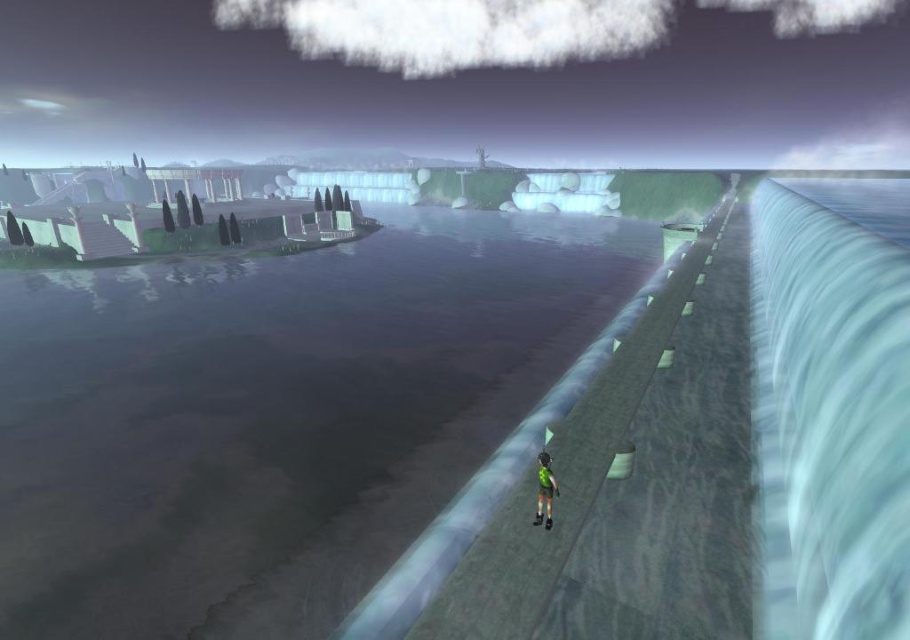
You are a drone operator trying to capture a photo of the dam from above. The drone has a camera that can only focus on objects within a 0.1 unit radius around the point 0.6, 0.3. Will the smooth concrete water at center be in focus?

The smooth concrete water at center is located at point (273, 416), which is within the 0.1 unit radius of the camera focus point (273, 384). Therefore, the smooth concrete water at center will be in focus.

You are a character in the game needing to cross from one side of the dam to the other. You see the smooth concrete water at center and the green fabric shorts at center. Which path is wider and safer for crossing?

The smooth concrete water at center is wider than the green fabric shorts at center, so the smooth concrete water at center is the safer path for crossing.

You are a character in a game needing to jump over the smooth concrete water at center. Can you see the green fabric shorts at center while jumping over the water?

The green fabric shorts at center is behind the smooth concrete water at center, so you cannot see the green fabric shorts at center while jumping over the water.